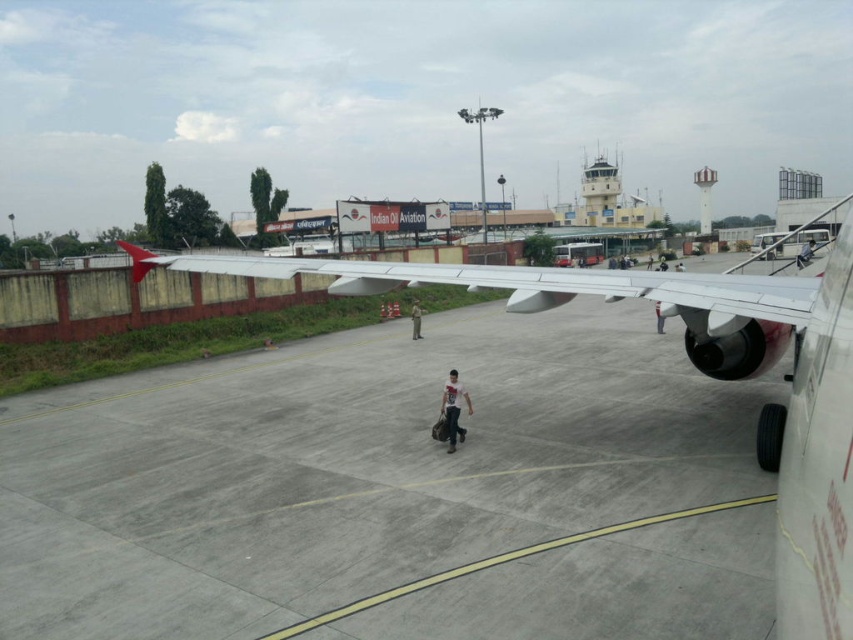
This screenshot has width=853, height=640. What are the coordinates of `metallic gray wing at center` in the screenshot? It's located at (718, 372).

Is metallic gray wing at center above matte black person at center?

Indeed, metallic gray wing at center is positioned over matte black person at center.

What do you see at coordinates (718, 372) in the screenshot? The width and height of the screenshot is (853, 640). I see `metallic gray wing at center` at bounding box center [718, 372].

Identify the location of metallic gray wing at center. (718, 372).

Who is lower down, polished aluminum wing at center or white cotton shirt at center?

white cotton shirt at center

Based on the photo, can you confirm if polished aluminum wing at center is smaller than white cotton shirt at center?

Incorrect, polished aluminum wing at center is not smaller in size than white cotton shirt at center.

Who is more forward, (213, 256) or (447, 404)?

Point (447, 404) is in front.

Find the location of `polished aluminum wing at center`. polished aluminum wing at center is located at coordinates coord(527,284).

Is point (741, 291) positioned before point (418, 305)?

Yes, point (741, 291) is closer to viewer.

Who is positioned more to the right, polished aluminum wing at center or gray fabric pants at center?

gray fabric pants at center is more to the right.

Is point (781, 307) positioned in front of point (410, 333)?

Yes, it is in front of point (410, 333).

Identify the location of polished aluminum wing at center. (527, 284).